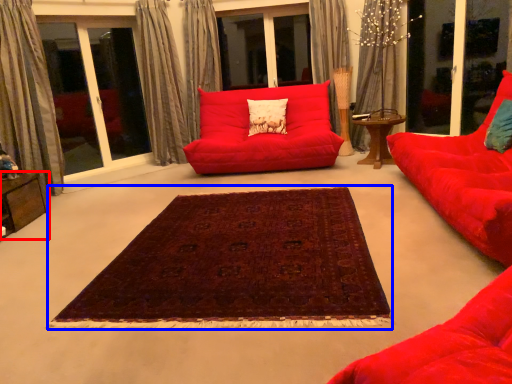
Question: Which object is closer to the camera taking this photo, table (highlighted by a red box) or mat (highlighted by a blue box)?

Choices:
 (A) table
 (B) mat

Answer: (B)